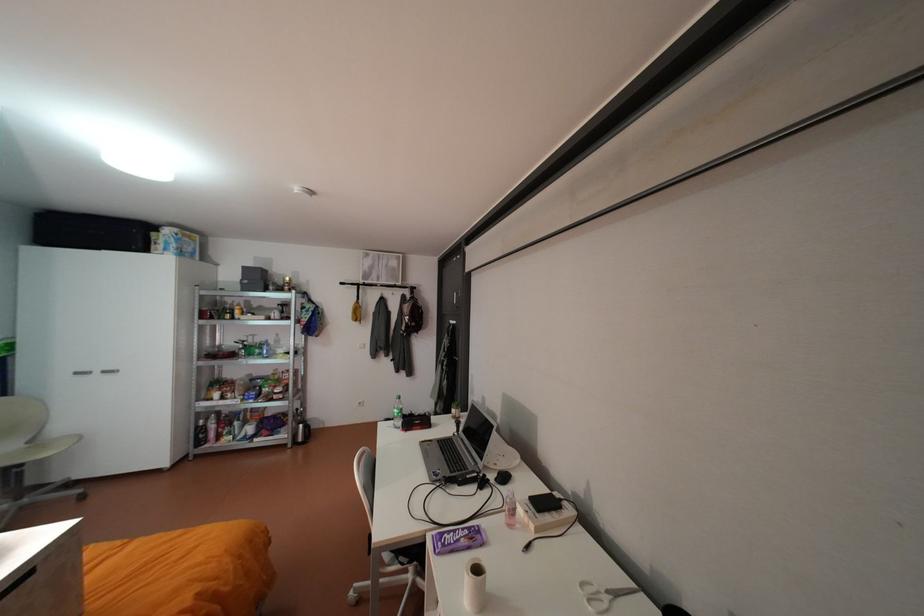
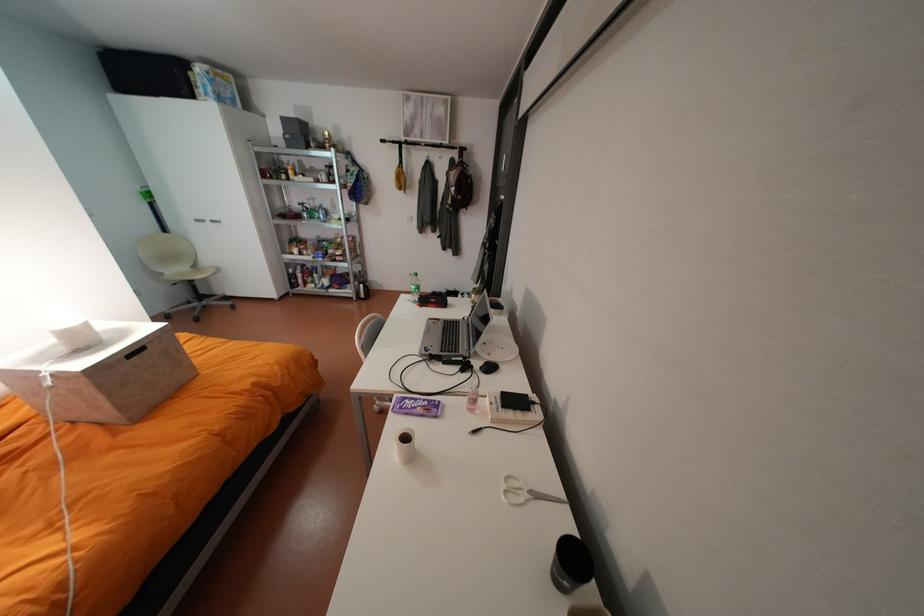
The first image is from the beginning of the video and the second image is from the end. How did the camera likely rotate when shooting the video?

The camera's rotation is toward left-down.